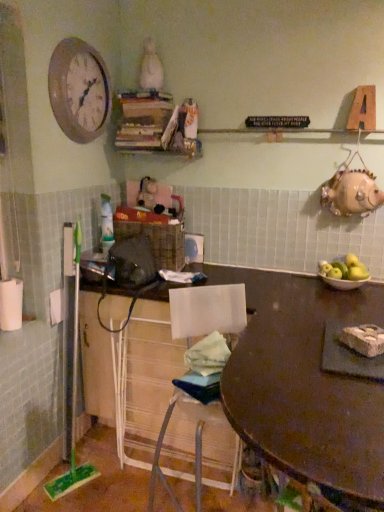
The height and width of the screenshot is (512, 384). I want to click on free space to the left of white wire mesh cabinet at lower center, so click(104, 485).